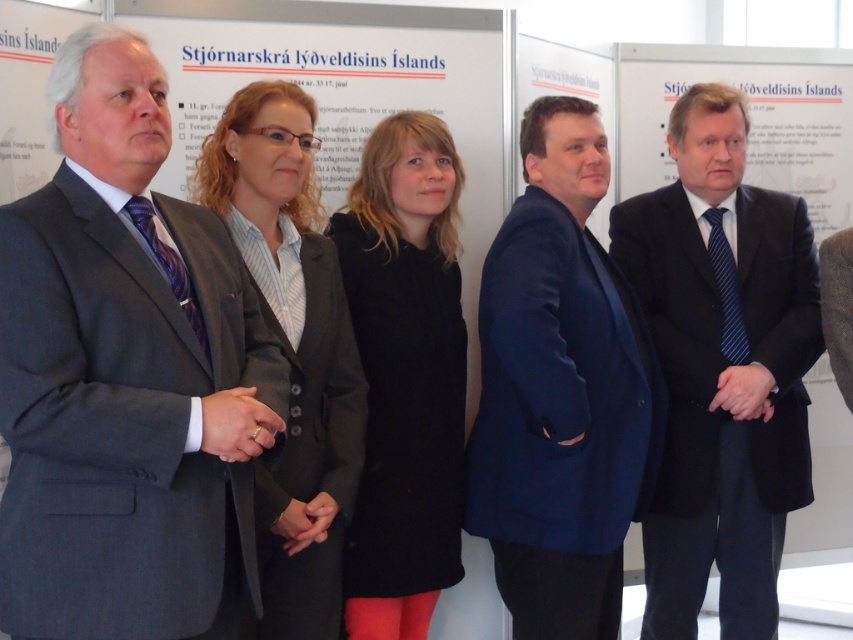
Question: Which point appears closest to the camera in this image?

Choices:
 (A) (715, 92)
 (B) (190, 276)
 (C) (251, 262)

Answer: (B)

Question: Considering the real-world distances, which object is farthest from the matte gray suit at left?

Choices:
 (A) matte black suit at right
 (B) black wool coat at center
 (C) matte black blazer at center

Answer: (A)

Question: Is matte black suit at center bigger than matte black suit at right?

Choices:
 (A) yes
 (B) no

Answer: (A)

Question: Can you confirm if matte gray suit at left is bigger than matte black blazer at center?

Choices:
 (A) yes
 (B) no

Answer: (B)

Question: Can you confirm if blue fabric suit at center is positioned to the left of matte black blazer at center?

Choices:
 (A) yes
 (B) no

Answer: (B)

Question: Which point is farther to the camera?

Choices:
 (A) matte black suit at right
 (B) matte gray suit at left
 (C) blue fabric suit at center

Answer: (A)